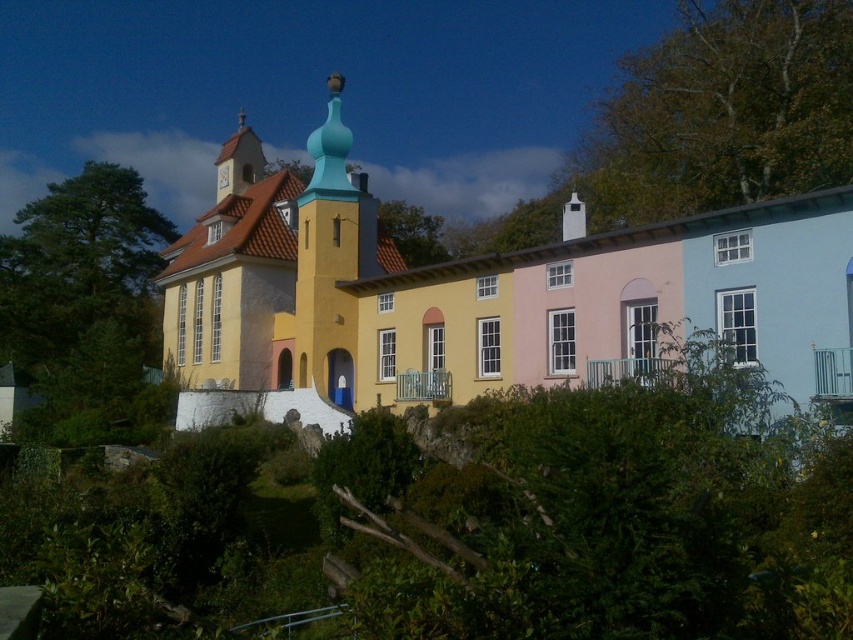
Question: Which is farther from the yellow matte building at center?

Choices:
 (A) green leafy tree at upper right
 (B) green leafy tree at center

Answer: (A)

Question: Which point is closer to the camera?

Choices:
 (A) green leafy tree at upper right
 (B) green leafy tree at center
 (C) green leafy tree at left

Answer: (A)

Question: Can you confirm if green leafy tree at upper right is thinner than green leafy tree at left?

Choices:
 (A) no
 (B) yes

Answer: (B)

Question: Is green leafy tree at left to the left of green leafy tree at center from the viewer's perspective?

Choices:
 (A) no
 (B) yes

Answer: (B)

Question: Is green leafy tree at upper right below green leafy tree at left?

Choices:
 (A) no
 (B) yes

Answer: (A)

Question: Which object is farther from the camera taking this photo?

Choices:
 (A) green leafy tree at upper right
 (B) green leafy tree at left

Answer: (B)